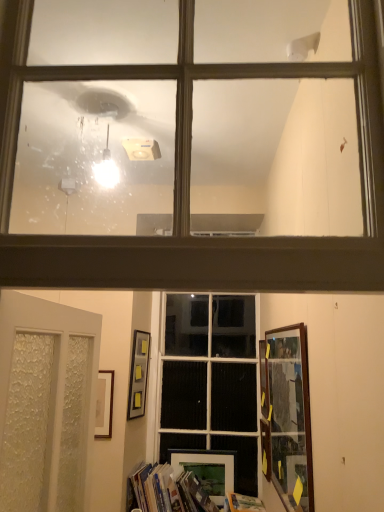
Question: Does white frosted glass door at lower left have a larger size compared to hardcover book at lower center?

Choices:
 (A) no
 (B) yes

Answer: (B)

Question: Does white frosted glass door at lower left have a lesser height compared to hardcover book at lower center?

Choices:
 (A) no
 (B) yes

Answer: (A)

Question: Is white frosted glass door at lower left aimed at hardcover book at lower center?

Choices:
 (A) no
 (B) yes

Answer: (A)

Question: Would you consider white frosted glass door at lower left to be distant from hardcover book at lower center?

Choices:
 (A) yes
 (B) no

Answer: (A)

Question: Is white frosted glass door at lower left at the left side of hardcover book at lower center?

Choices:
 (A) no
 (B) yes

Answer: (B)

Question: Is wooden picture frame at lower right, acting as the 4th picture frame starting from the left, wider or thinner than matte black picture frame at lower center, which appears as the fourth picture frame when viewed from the front?

Choices:
 (A) wide
 (B) thin

Answer: (A)

Question: Is point (264, 428) positioned closer to the camera than point (235, 454)?

Choices:
 (A) closer
 (B) farther

Answer: (A)

Question: Visually, is wooden picture frame at lower right, the third picture frame positioned from the back, positioned to the left or to the right of matte black picture frame at lower center, the third picture frame positioned from the right?

Choices:
 (A) left
 (B) right

Answer: (B)

Question: Choose the correct answer: Is wooden picture frame at lower right, the third picture frame positioned from the back, inside matte black picture frame at lower center, which ranks as the 2th picture frame in left-to-right order, or outside it?

Choices:
 (A) outside
 (B) inside

Answer: (A)

Question: Is hardcover book at lower center in front of or behind white frosted glass door at lower left in the image?

Choices:
 (A) behind
 (B) front

Answer: (A)

Question: Is point (261, 503) closer or farther from the camera than point (31, 433)?

Choices:
 (A) closer
 (B) farther

Answer: (B)

Question: Visually, is hardcover book at lower center positioned to the left or to the right of white frosted glass door at lower left?

Choices:
 (A) left
 (B) right

Answer: (B)

Question: From the image's perspective, relative to white frosted glass door at lower left, is hardcover book at lower center above or below?

Choices:
 (A) below
 (B) above

Answer: (A)

Question: Considering their positions, is matte glass window at upper center, the first window when ordered from front to back, located in front of or behind wooden picture frame at lower right, acting as the 4th picture frame starting from the left?

Choices:
 (A) behind
 (B) front

Answer: (B)

Question: Is point [4, 239] positioned closer to the camera than point [263, 443]?

Choices:
 (A) farther
 (B) closer

Answer: (B)